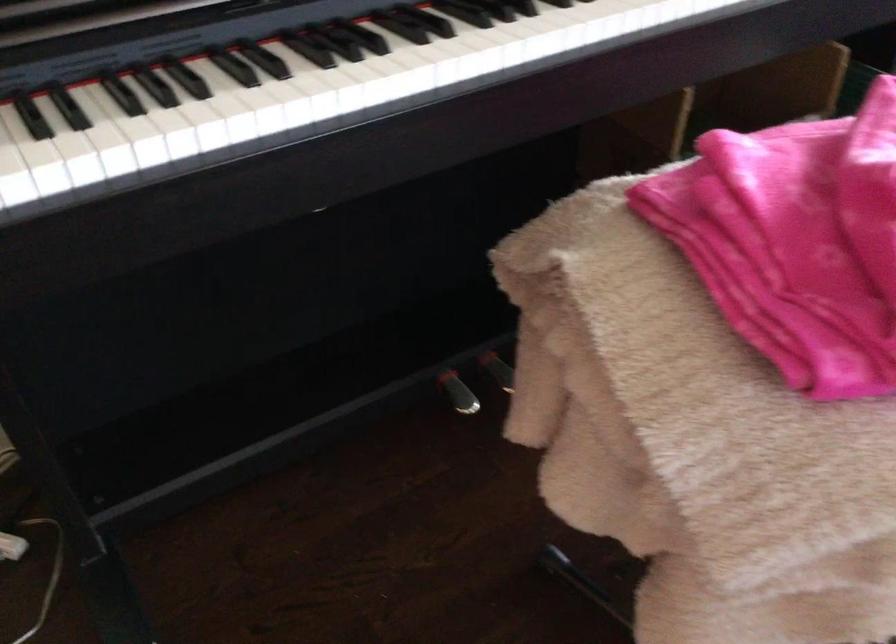
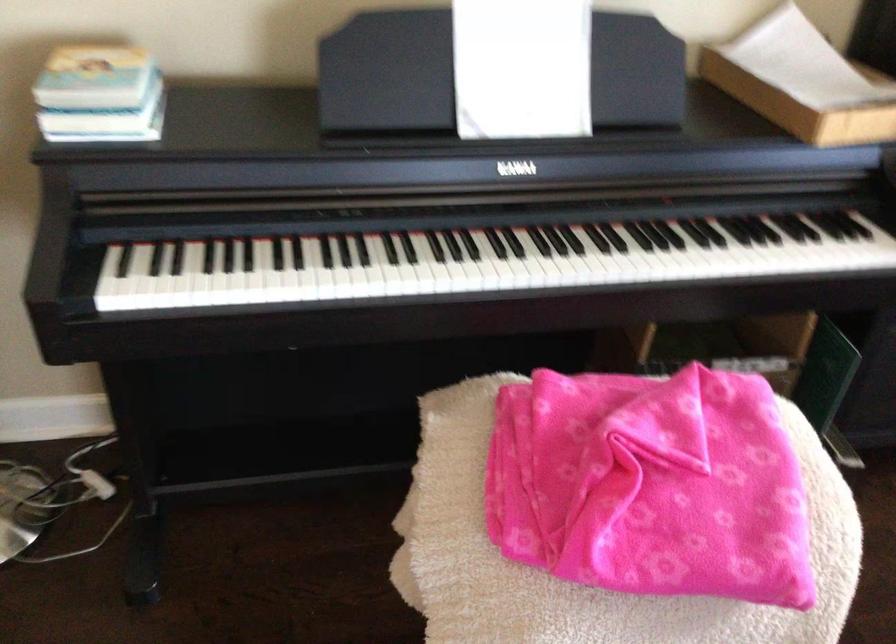
The images are taken continuously from a first-person perspective. In which direction are you moving?

The movement direction of the cameraman is right, backward.